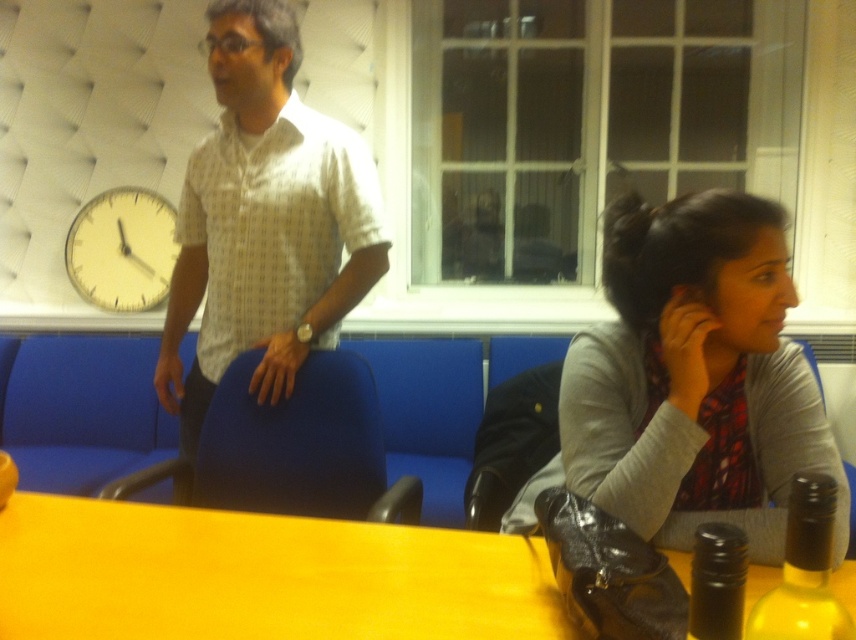
Question: Is white dotted shirt at center bigger than yellow matte clock at upper left?

Choices:
 (A) no
 (B) yes

Answer: (B)

Question: Estimate the real-world distances between objects in this image. Which object is farther from the white dotted shirt at center?

Choices:
 (A) gray fabric shirt at lower right
 (B) yellow matte clock at upper left

Answer: (B)

Question: Which point is closer to the camera?

Choices:
 (A) yellow matte clock at upper left
 (B) gray fabric shirt at lower right
 (C) white dotted shirt at center
 (D) yellow matte table at lower center

Answer: (D)

Question: Which point is farther from the camera taking this photo?

Choices:
 (A) (73, 625)
 (B) (282, 83)
 (C) (165, 250)

Answer: (C)

Question: Can you confirm if yellow matte table at lower center is positioned below white dotted shirt at center?

Choices:
 (A) no
 (B) yes

Answer: (B)

Question: Can you confirm if yellow matte table at lower center is positioned above yellow matte clock at upper left?

Choices:
 (A) yes
 (B) no

Answer: (B)